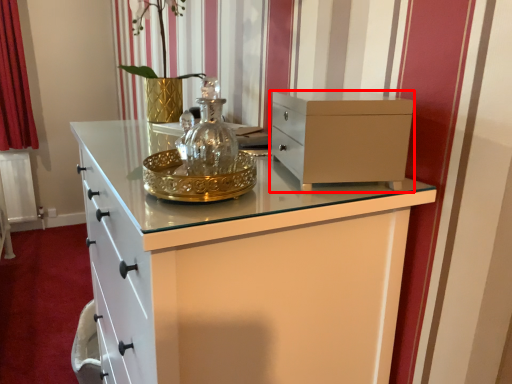
Question: From the image's perspective, where is chest of drawers (annotated by the red box) located relative to curtain?

Choices:
 (A) below
 (B) above

Answer: (A)